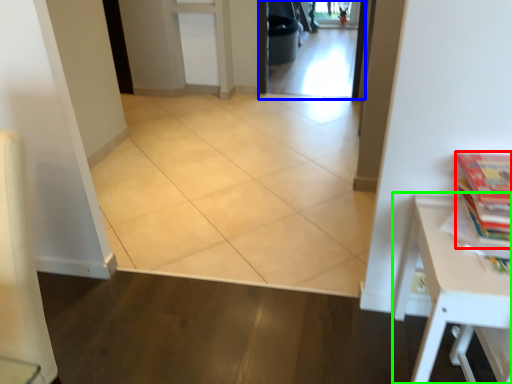
Question: Which object is the closest to the book (highlighted by a red box)? Choose among these: screen door (highlighted by a blue box) or table (highlighted by a green box).

Choices:
 (A) screen door
 (B) table

Answer: (B)